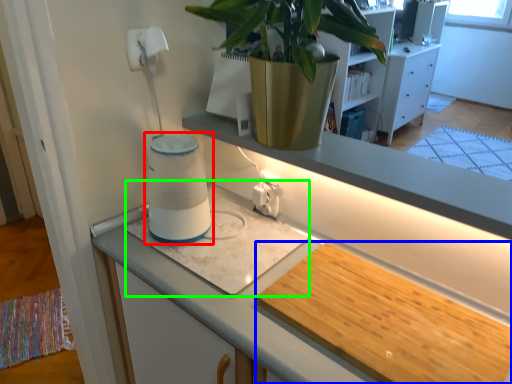
Question: Which is farther away from water heater (highlighted by a red box)? wide (highlighted by a blue box) or wide (highlighted by a green box)?

Choices:
 (A) wide
 (B) wide

Answer: (A)